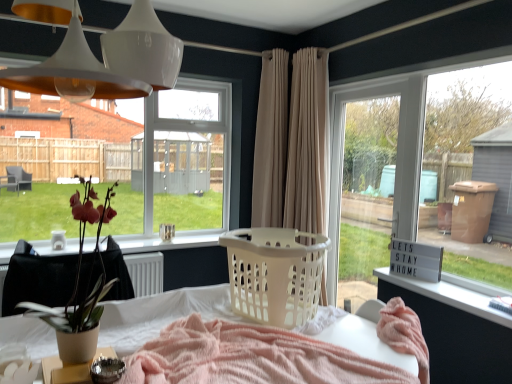
In order to click on blank space above white plastic changing table at lower right (from a real-world perspective) in this screenshot , I will do `click(464, 296)`.